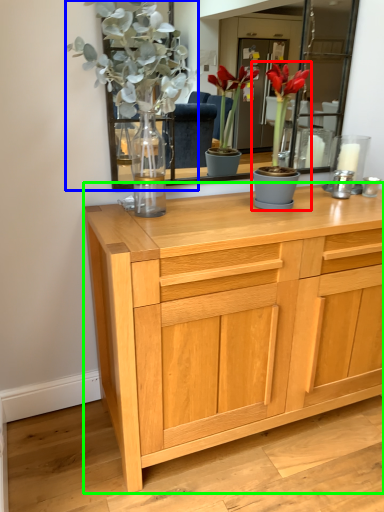
Question: Estimate the real-world distances between objects in this image. Which object is closer to houseplant (highlighted by a red box), floral arrangement (highlighted by a blue box) or chest of drawers (highlighted by a green box)?

Choices:
 (A) floral arrangement
 (B) chest of drawers

Answer: (A)